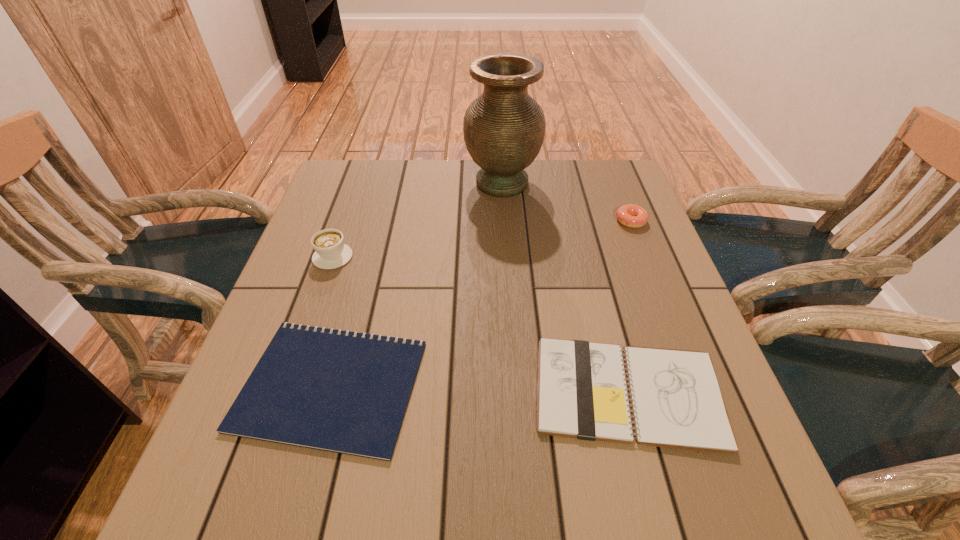
What are the coordinates of `object that ranks as the closest to the taller notepad` in the screenshot? It's located at (332, 390).

The height and width of the screenshot is (540, 960). Identify the location of the closest object to the right notepad. (332, 390).

Find the location of a particular element. The width and height of the screenshot is (960, 540). free space that satisfies the following two spatial constraints: 1. on the front side of the shortest object; 2. on the right side of the right notepad is located at coordinates (329, 393).